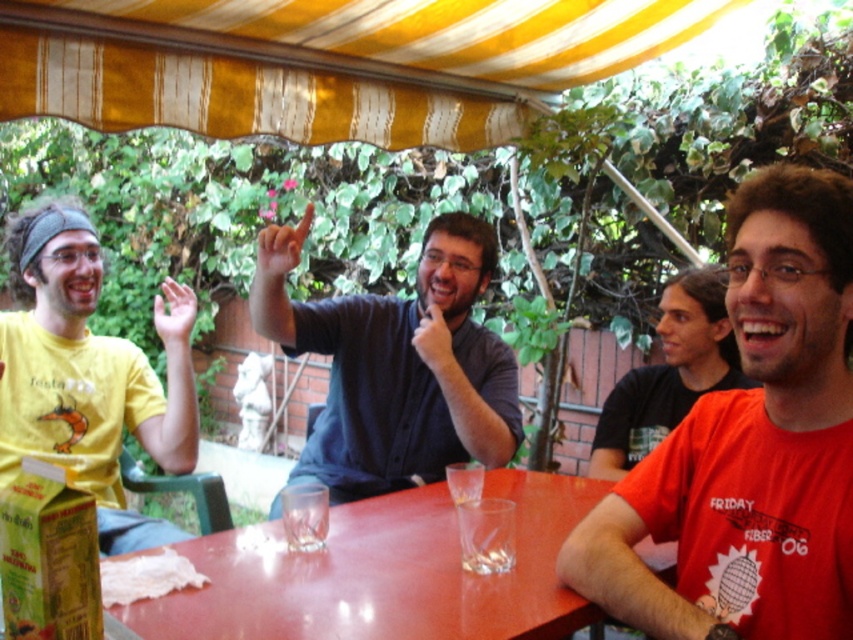
From the picture: You are standing at the edge of the gathering area and want to place a small vase on the smooth glossy wood table at center. The coordinates given are in a normalized system where the bottom left corner is the origin. If the table is at point (384, 573), which direction should you move to reach it?

The point (384, 573) indicates the table is located towards the upper right of the image. Since the origin is the bottom left, moving towards the upper right direction will lead you to the smooth glossy wood table at center.